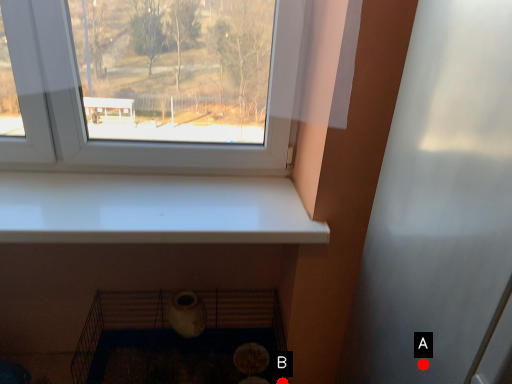
Question: Two points are circled on the image, labeled by A and B beside each circle. Which of the following is the closest to the observer?

Choices:
 (A) A is closer
 (B) B is closer

Answer: (A)